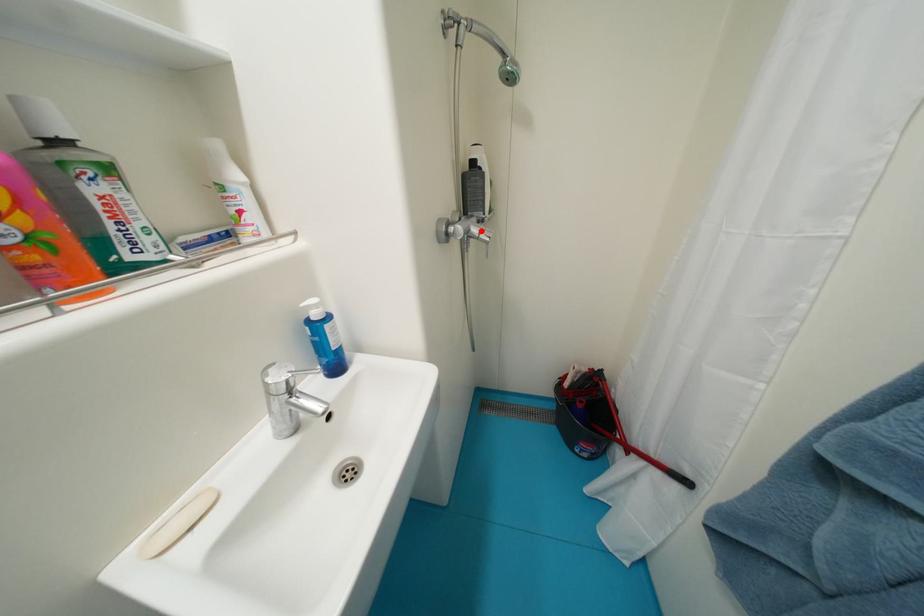
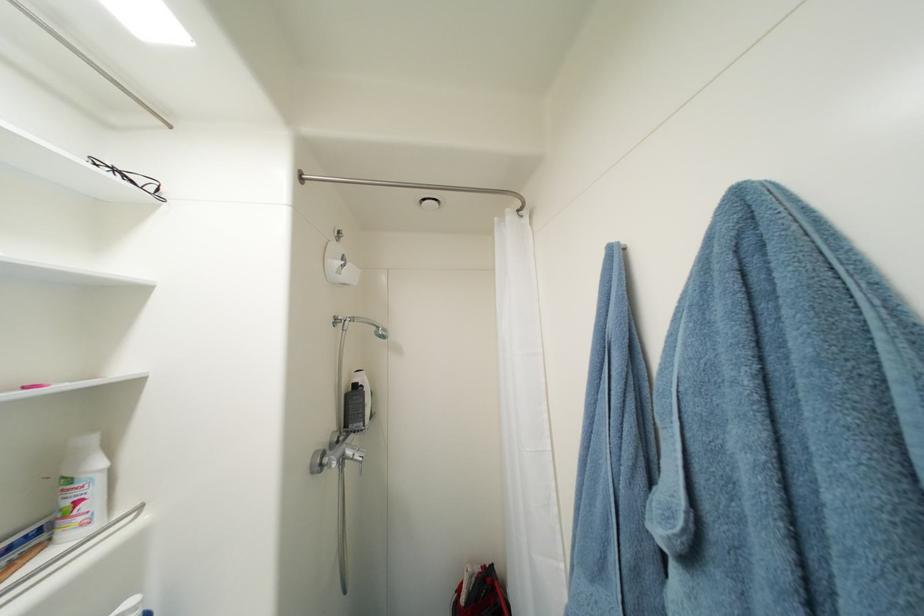
Where in the second image is the point corresponding to the highlighted location from the first image?

(356, 454)